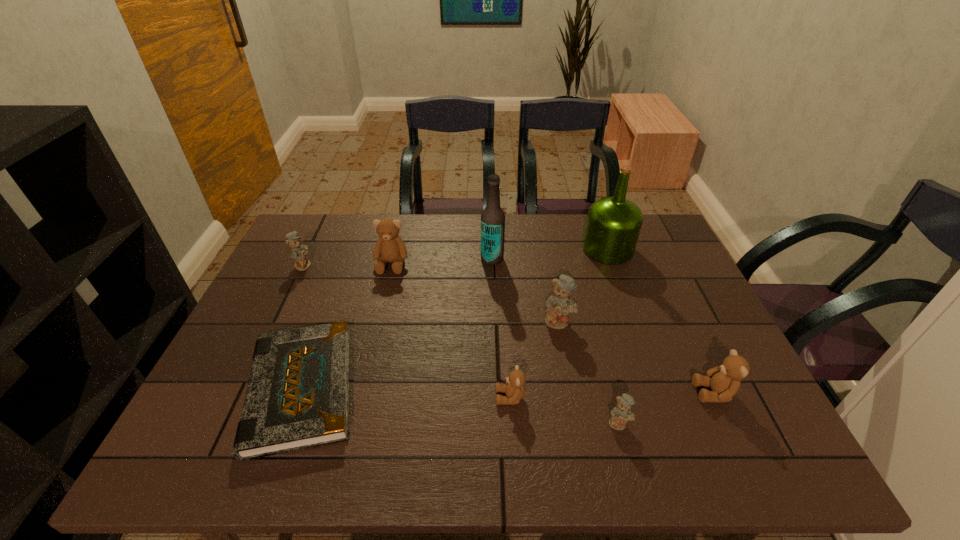
You are a GUI agent. You are given a task and a screenshot of the screen. Output one action in this format:
    pyautogui.click(x=<x>, y=<y>)
    Task: Click on the free space located on the back of the notebook
    The image size is (960, 540).
    Given the screenshot: What is the action you would take?
    pyautogui.click(x=337, y=291)

The height and width of the screenshot is (540, 960). In order to click on olive oil that is at the far edge in this screenshot , I will do `click(613, 225)`.

Locate an element on the screen. The width and height of the screenshot is (960, 540). beer bottle located in the far edge section of the desktop is located at coordinates (492, 217).

Find the location of a particular element. teddy bear located in the far edge section of the desktop is located at coordinates (389, 247).

This screenshot has width=960, height=540. Find the location of `teddy bear located in the near edge section of the desktop`. teddy bear located in the near edge section of the desktop is located at coordinates (621, 414).

Locate an element on the screen. The image size is (960, 540). notebook at the near edge is located at coordinates (297, 397).

What are the coordinates of `teddy bear located in the left edge section of the desktop` in the screenshot? It's located at (298, 252).

This screenshot has width=960, height=540. Identify the location of notebook present at the left edge. (297, 397).

This screenshot has width=960, height=540. Identify the location of olive oil that is at the right edge. (613, 225).

Where is `teddy bear that is at the right edge`? The width and height of the screenshot is (960, 540). teddy bear that is at the right edge is located at coordinates [x=724, y=380].